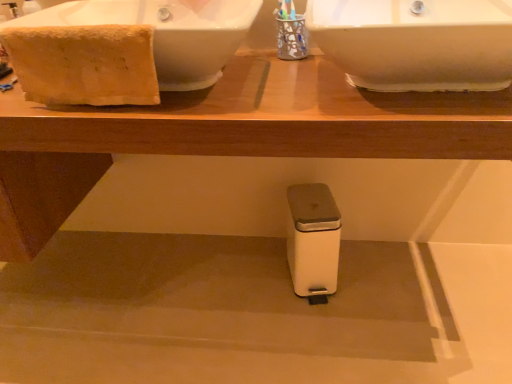
At what (x,y) coordinates should I click in order to perform the action: click on free spot to the right of beige cotton towel at upper left. Please return your answer as a coordinate pair (x, y). Looking at the image, I should click on (211, 98).